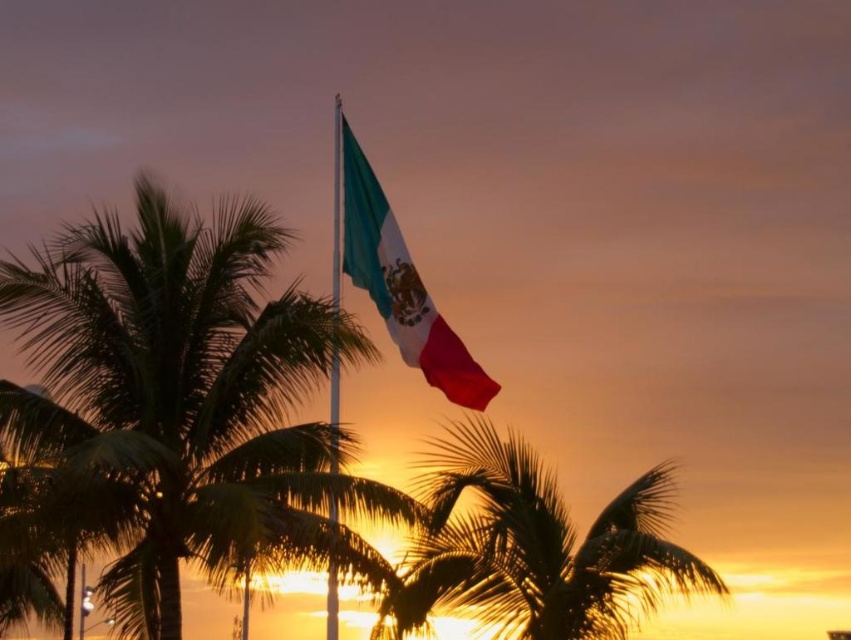
Which is behind, point (101, 452) or point (529, 616)?

The point (101, 452) is behind.

Does green leafy palm tree at center have a greater height compared to silky gold palm tree at center?

Yes, green leafy palm tree at center is taller than silky gold palm tree at center.

Does point (311, 451) come closer to viewer compared to point (540, 461)?

Yes, it is.

Where is `green leafy palm tree at center`? This screenshot has height=640, width=851. green leafy palm tree at center is located at coordinates (181, 388).

Does green leafy palm tree at center have a greater height compared to metallic flag pole at center?

Incorrect, green leafy palm tree at center's height is not larger of metallic flag pole at center's.

Between point (135, 483) and point (333, 269), which one is positioned behind?

The point (333, 269) is behind.

I want to click on green leafy palm tree at center, so click(181, 388).

Is silky gold palm tree at center to the right of silky fabric flag at center from the viewer's perspective?

Indeed, silky gold palm tree at center is positioned on the right side of silky fabric flag at center.

Does silky gold palm tree at center have a greater width compared to silky fabric flag at center?

Yes, silky gold palm tree at center is wider than silky fabric flag at center.

Where is `silky gold palm tree at center`? The image size is (851, 640). silky gold palm tree at center is located at coordinates (533, 547).